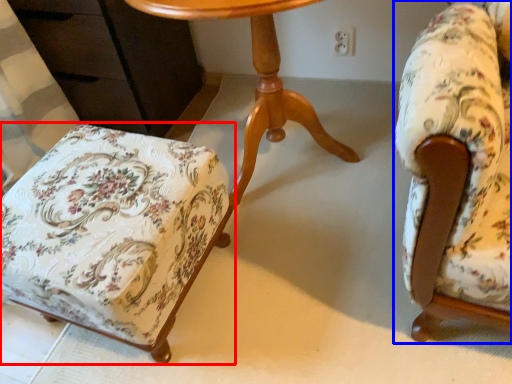
Question: Among these objects, which one is farthest to the camera, chair (highlighted by a red box) or chair (highlighted by a blue box)?

Choices:
 (A) chair
 (B) chair

Answer: (A)